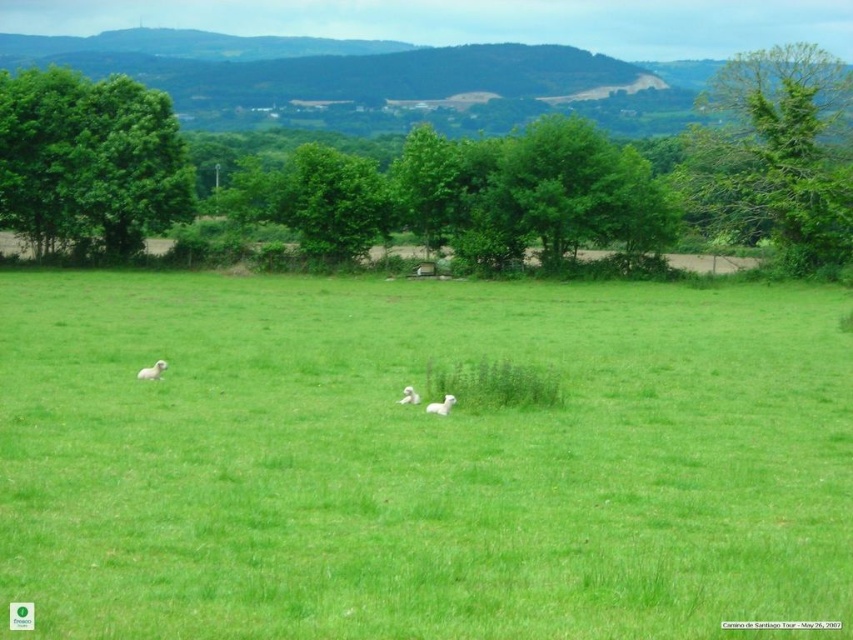
Which is more to the right, green leafy tree at center or white fluffy sheep at center?

white fluffy sheep at center

Does green leafy tree at center come behind white fluffy sheep at center?

Yes, it is.

At what (x,y) coordinates should I click in order to perform the action: click on green leafy tree at center. Please return your answer as a coordinate pair (x, y). The height and width of the screenshot is (640, 853). Looking at the image, I should click on (332, 202).

This screenshot has width=853, height=640. Identify the location of green leafy tree at center. (332, 202).

From the picture: Is green leafy tree at upper right thinner than white fluffy sheep at center?

No, green leafy tree at upper right is not thinner than white fluffy sheep at center.

Describe the element at coordinates (776, 154) in the screenshot. The image size is (853, 640). I see `green leafy tree at upper right` at that location.

Where is `green leafy tree at upper right`? The width and height of the screenshot is (853, 640). green leafy tree at upper right is located at coordinates (776, 154).

The height and width of the screenshot is (640, 853). Describe the element at coordinates (419, 460) in the screenshot. I see `green grass pasture at center` at that location.

Does green grass pasture at center have a lesser height compared to white fluffy sheep at center?

Incorrect, green grass pasture at center's height does not fall short of white fluffy sheep at center's.

The image size is (853, 640). Find the location of `green grass pasture at center`. green grass pasture at center is located at coordinates (419, 460).